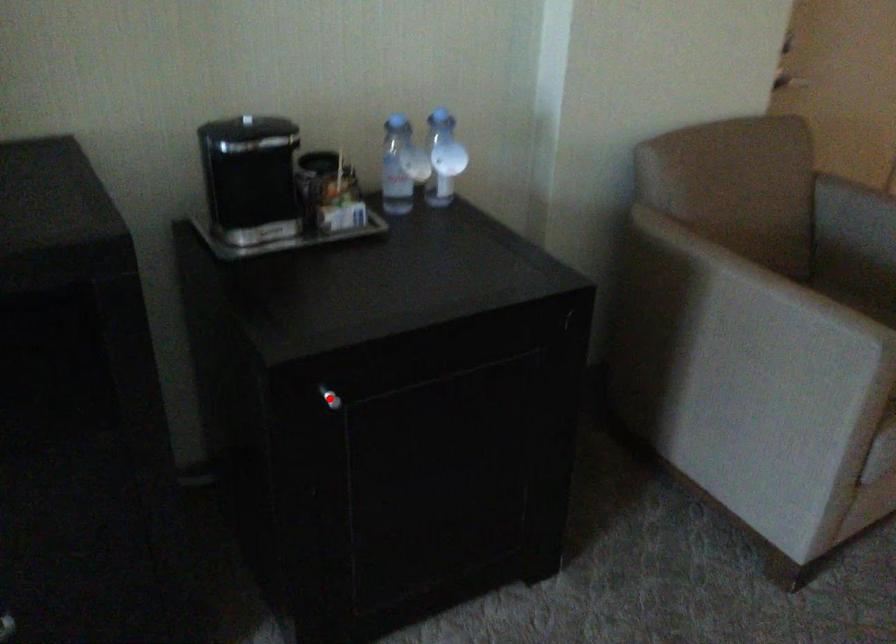
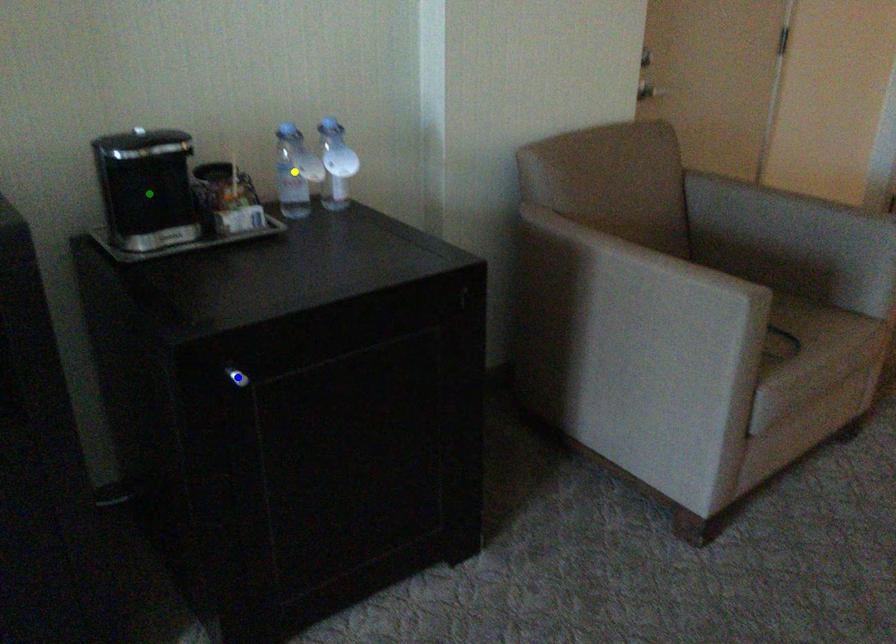
Question: I am providing you with two images of the same scene from different viewpoints. A red point is marked on the first image. You are given multiple points on the second image. Which mark in image 2 goes with the point in image 1?

Choices:
 (A) yellow point
 (B) green point
 (C) blue point

Answer: (C)